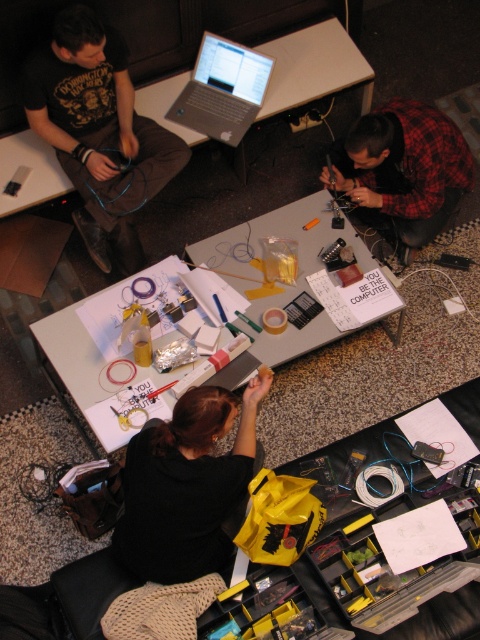
You are standing in the room and want to place a small object exactly at the center of the white paper at center. According to the coordinates provided, where should you place it?

The white paper at center is located at point [297,278], so you should place the object at those coordinates to center it.

You are a tailor measuring the red plaid shirt at upper right and the yellow fabric bag at center. Which item requires more fabric in terms of width?

The yellow fabric bag at center requires more fabric in terms of width since its width is greater than the red plaid shirt at upper right.